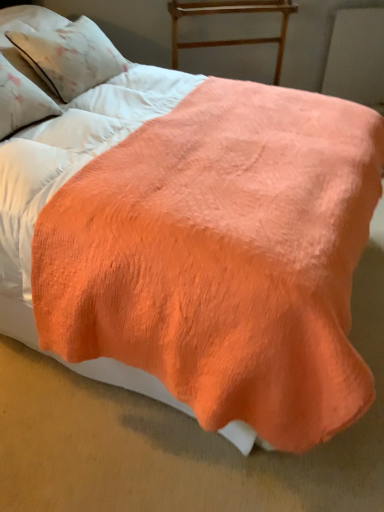
Image resolution: width=384 pixels, height=512 pixels. Describe the element at coordinates (231, 13) in the screenshot. I see `wooden table at upper center` at that location.

Identify the location of wooden table at upper center. (231, 13).

Locate an element on the screen. wooden table at upper center is located at coordinates (231, 13).